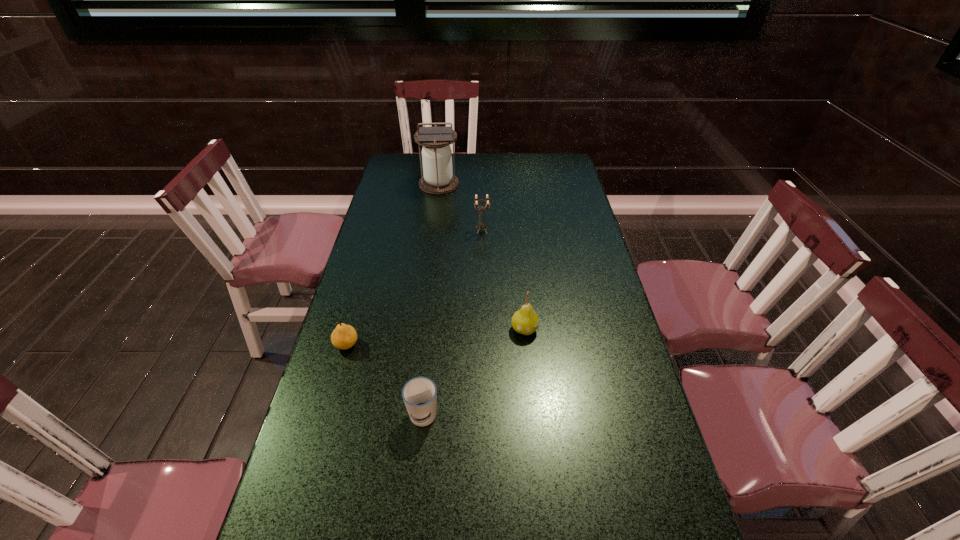
Where is `vacant space at the right edge of the desktop`? vacant space at the right edge of the desktop is located at coordinates (652, 426).

In the image, there is a desktop. Identify the location of vacant space at the far left corner. (396, 156).

Locate an element on the screen. The width and height of the screenshot is (960, 540). empty space that is in between the candle holder and the tallest object is located at coordinates (461, 207).

In order to click on free area in between the cup and the farthest object in this screenshot , I will do `click(431, 301)`.

I want to click on free space between the left pear and the rightmost object, so point(436,337).

Identify the location of free point between the farthest object and the left pear. The image size is (960, 540). [393, 264].

I want to click on unoccupied position between the right pear and the lantern, so click(x=482, y=256).

Where is `empty location between the tallest object and the right pear`? empty location between the tallest object and the right pear is located at coordinates (482, 256).

Where is `free spot between the cup and the lantern`? The height and width of the screenshot is (540, 960). free spot between the cup and the lantern is located at coordinates (431, 301).

Where is `object that can be found as the fourth closest to the shorter pear`? Image resolution: width=960 pixels, height=540 pixels. object that can be found as the fourth closest to the shorter pear is located at coordinates click(x=437, y=178).